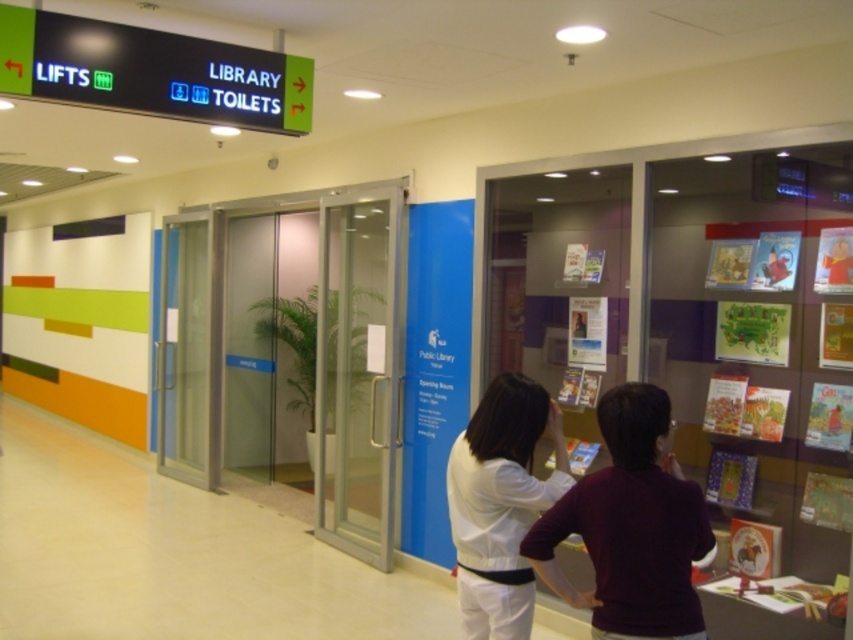
You are a maintenance worker needing to access the transparent glass elevator at center. You are currently standing at the maroon sweater at center. Which direction should you move to reach the elevator?

Since the transparent glass elevator at center is further to the viewer than the maroon sweater at center, you should move forward towards the elevator.

You are a maintenance worker needing to access the transparent glass elevator at center. You are currently standing next to the white matte shirt at center. Can you reach the elevator without moving your position?

The transparent glass elevator at center is located above the white matte shirt at center, so you can reach it without moving your position as it is above you.